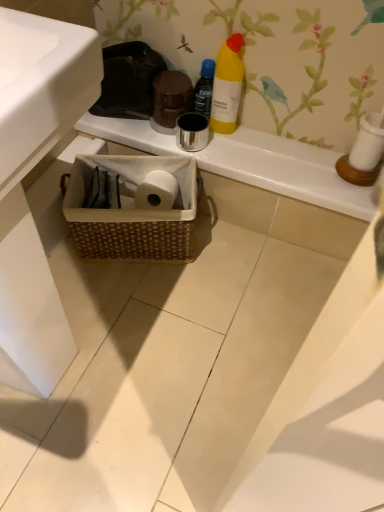
Locate an element on the screen. The height and width of the screenshot is (512, 384). free space to the right of yellow matte bottle at upper center, positioned as the second bottle in right-to-left order is located at coordinates [x=269, y=139].